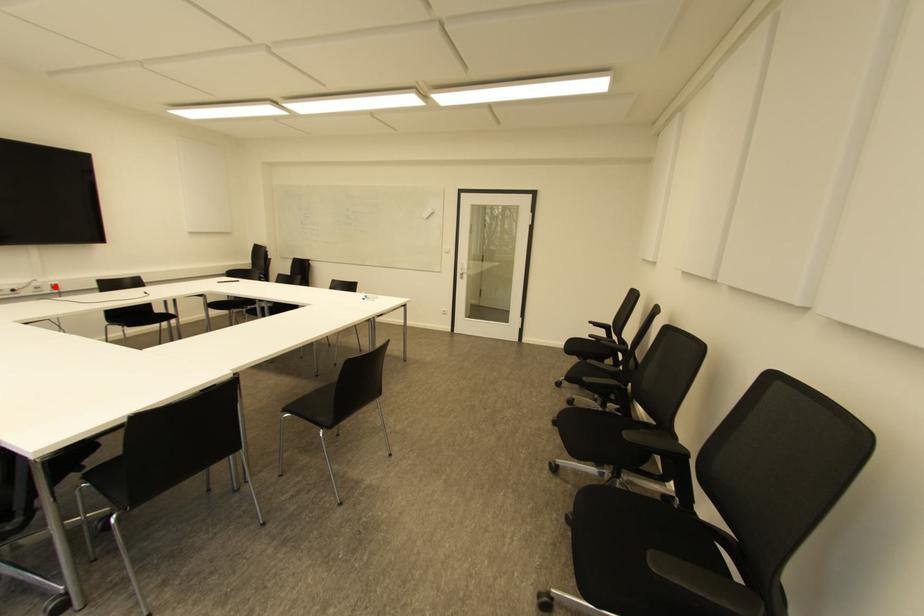
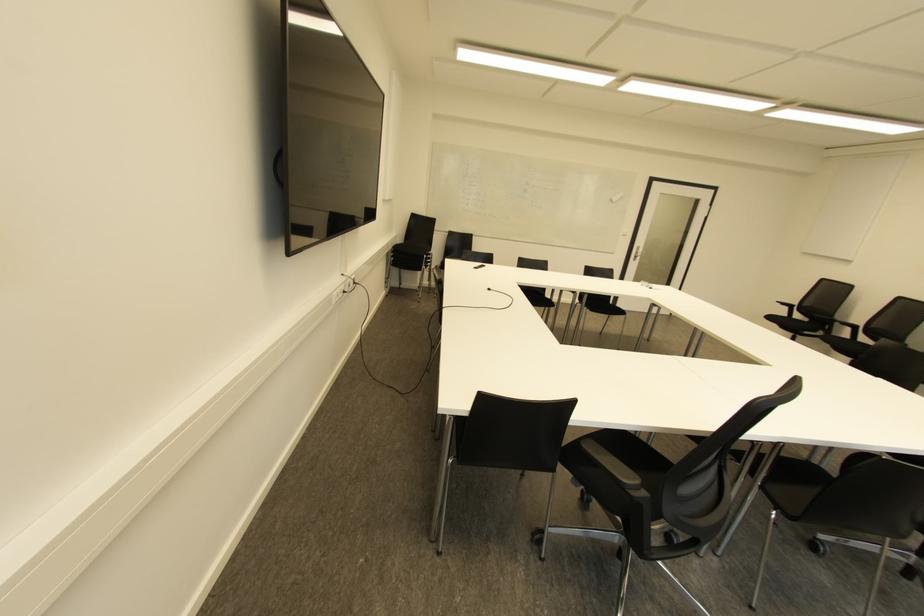
The point at the highlighted location is marked in the first image. Where is the corresponding point in the second image?

(354, 282)